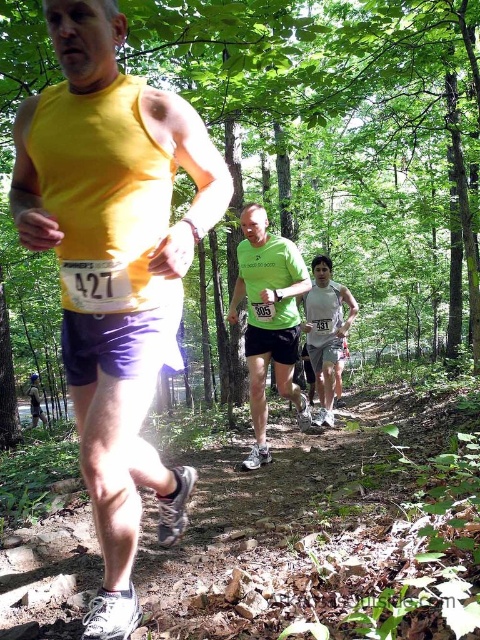
Question: Which point appears farthest from the camera in this image?

Choices:
 (A) (328, 358)
 (B) (308, 410)

Answer: (A)

Question: Is the position of matte yellow tank top at center more distant than that of white mesh tank top at center?

Choices:
 (A) no
 (B) yes

Answer: (A)

Question: Is green matte shirt at center thinner than white mesh tank top at center?

Choices:
 (A) no
 (B) yes

Answer: (A)

Question: Which point appears closest to the camera in this image?

Choices:
 (A) (61, 156)
 (B) (312, 364)

Answer: (A)

Question: Among these points, which one is nearest to the camera?

Choices:
 (A) pos(304,314)
 (B) pos(168,500)
 (C) pos(304,272)

Answer: (B)

Question: Is green matte shirt at center above white mesh tank top at center?

Choices:
 (A) no
 (B) yes

Answer: (A)